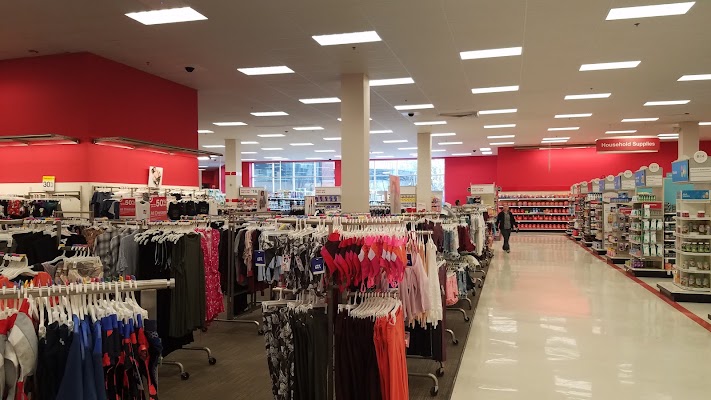
Find the location of a particular element. white pillar is located at coordinates (353, 151), (417, 167), (232, 164), (695, 140).